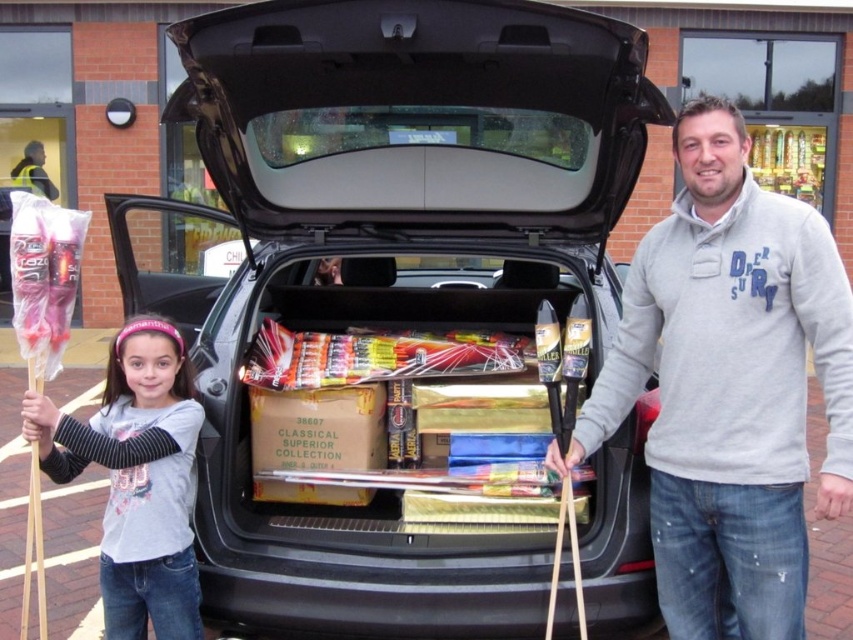
What is the 2D coordinate of the black matte car trunk at center?

The 2D coordinate of the black matte car trunk at center is at point (387, 294).

You are helping organize items in the car trunk and need to place a new box that is 5 feet long between the gray fleece sweater at center and the gray cotton shirt at lower left. Will there be enough space between them to fit the box?

The gray fleece sweater at center and gray cotton shirt at lower left are 5.33 feet apart from each other. Since the box is 5 feet long, there is enough space to fit it between them.

You are helping to unload items from the car trunk. You need to place a large box that is 3 feet tall onto the trunk. The trunk is currently filled with items. Considering the distance between the black matte car trunk at center and the gray cotton shirt at lower left, can you determine if there is enough vertical space in the trunk to fit the box?

The black matte car trunk at center is 36.48 inches away from the gray cotton shirt at lower left. Since the box is 3 feet tall, which is 36 inches, there is enough vertical space because the distance between them is 36.48 inches, which is slightly more than the box height.